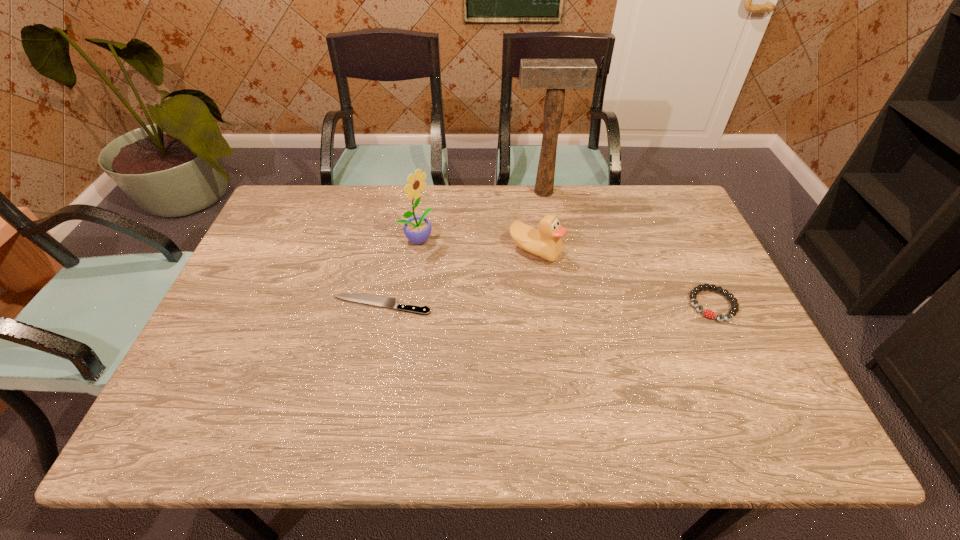
You are a GUI agent. You are given a task and a screenshot of the screen. Output one action in this format:
    pyautogui.click(x=<x>, y=<y>)
    Task: Click on the steak knife
    The image size is (960, 540).
    Given the screenshot: What is the action you would take?
    pyautogui.click(x=376, y=300)

Find the location of a particular element. the fourth tallest object is located at coordinates (708, 313).

Find the location of a particular element. bracelet is located at coordinates [x=708, y=313].

Where is `the farthest object`? Image resolution: width=960 pixels, height=540 pixels. the farthest object is located at coordinates (555, 75).

Identify the location of mallet. (555, 75).

Image resolution: width=960 pixels, height=540 pixels. I want to click on duck, so click(546, 242).

Identify the location of sunflower. (417, 229).

I want to click on vacant region located on the left of the steak knife, so pyautogui.click(x=306, y=305).

I want to click on free space located on the front of the rightmost object, so (755, 392).

Find the location of `vacant space positioned 0.240m on the striking surface of the mallet`. vacant space positioned 0.240m on the striking surface of the mallet is located at coordinates (553, 246).